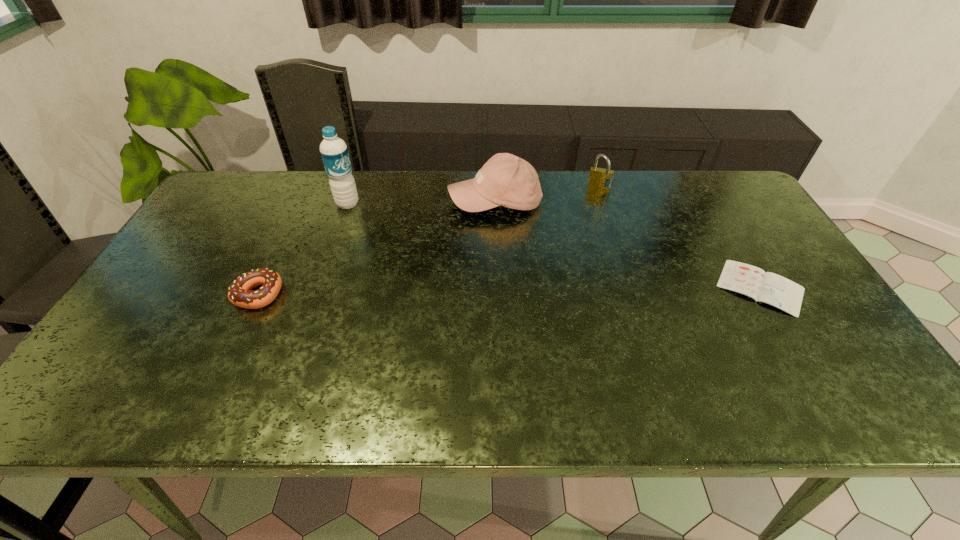
What are the coordinates of `vacant space located 0.210m on the right of the doughnut` in the screenshot? It's located at (365, 294).

Where is `vacant region located 0.270m on the left of the shortest object`? The width and height of the screenshot is (960, 540). vacant region located 0.270m on the left of the shortest object is located at coordinates (612, 287).

Identify the location of blank space located 0.380m on the side with the combination dials of the padlock. (579, 275).

In order to click on free region located 0.120m on the side with the combination dials of the padlock in this screenshot , I will do `click(592, 217)`.

You are a GUI agent. You are given a task and a screenshot of the screen. Output one action in this format:
    pyautogui.click(x=<x>, y=<y>)
    Task: Click on the free space located on the side with the combination dials of the padlock
    Image resolution: width=960 pixels, height=540 pixels.
    Given the screenshot: What is the action you would take?
    pyautogui.click(x=593, y=214)

Image resolution: width=960 pixels, height=540 pixels. I want to click on vacant space located 0.180m on the front-facing side of the third object from right to left, so click(x=454, y=258).

Find the location of a particular element. The image size is (960, 540). free point located on the front-facing side of the third object from right to left is located at coordinates (456, 255).

Find the location of a particular element. blank space located 0.350m on the front-facing side of the third object from right to left is located at coordinates (427, 302).

Identify the location of free region located on the label of the second object from left to right. (391, 233).

Where is `free space located 0.310m on the label of the second object from left to right`? The width and height of the screenshot is (960, 540). free space located 0.310m on the label of the second object from left to right is located at coordinates (423, 255).